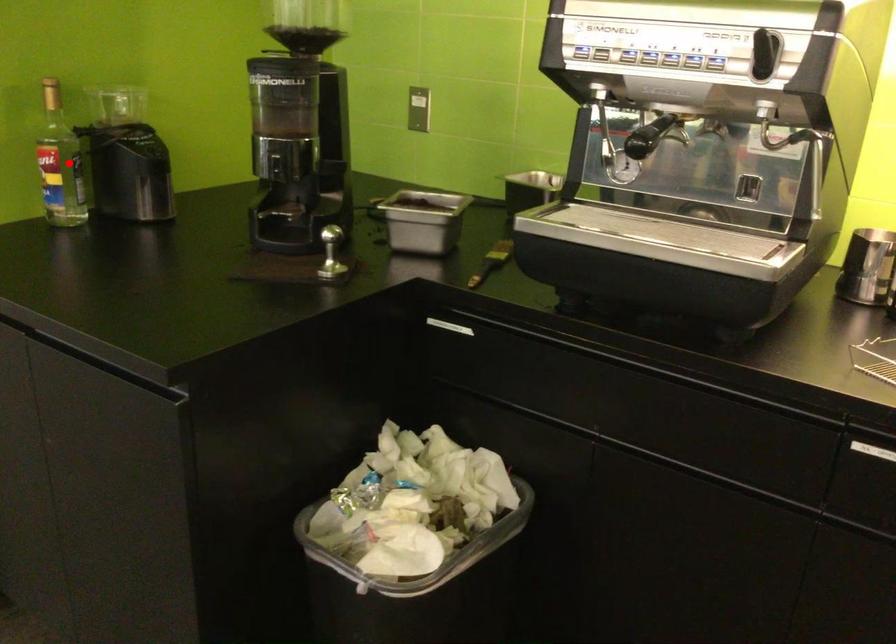
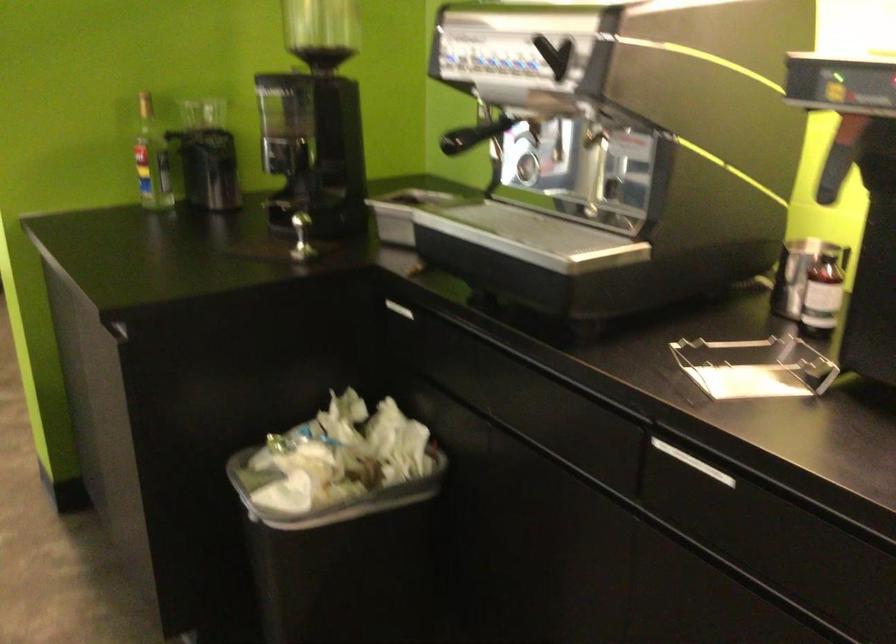
Question: A red point is marked in image1. In image2, is the corresponding 3D point closer to the camera or farther? Reply with the corresponding letter.

Choices:
 (A) The corresponding 3D point is closer.
 (B) The corresponding 3D point is farther.

Answer: (B)